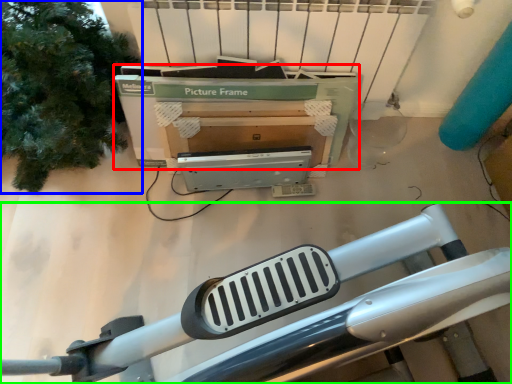
Question: Based on their relative distances, which object is nearer to box (highlighted by a red box)? Choose from tree (highlighted by a blue box) and furniture (highlighted by a green box).

Choices:
 (A) tree
 (B) furniture

Answer: (A)